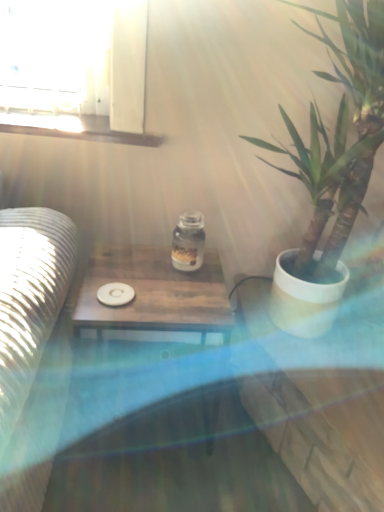
Image resolution: width=384 pixels, height=512 pixels. In order to click on vacant space to the right of white matte coaster at center in this screenshot , I will do coord(169,298).